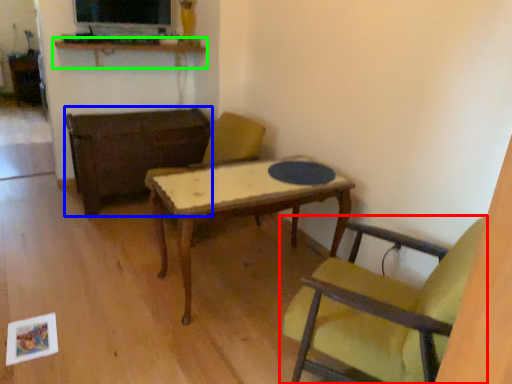
Question: Which object is the farthest from chair (highlighted by a red box)? Choose among these: table (highlighted by a blue box) or shelf (highlighted by a green box).

Choices:
 (A) table
 (B) shelf

Answer: (B)